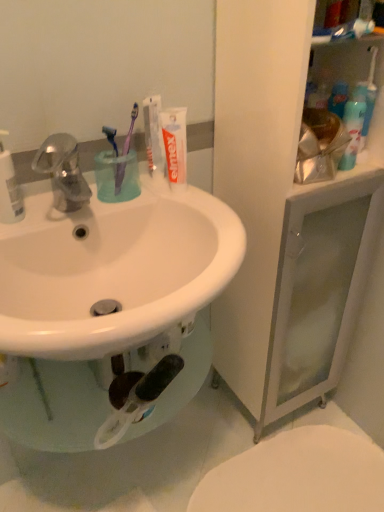
Where is `vacant area that lies between matte silver faucet at upper left and white plastic bottle at left, the 1th cleaning product in the front-to-back sequence`? Image resolution: width=384 pixels, height=512 pixels. vacant area that lies between matte silver faucet at upper left and white plastic bottle at left, the 1th cleaning product in the front-to-back sequence is located at coordinates (33, 217).